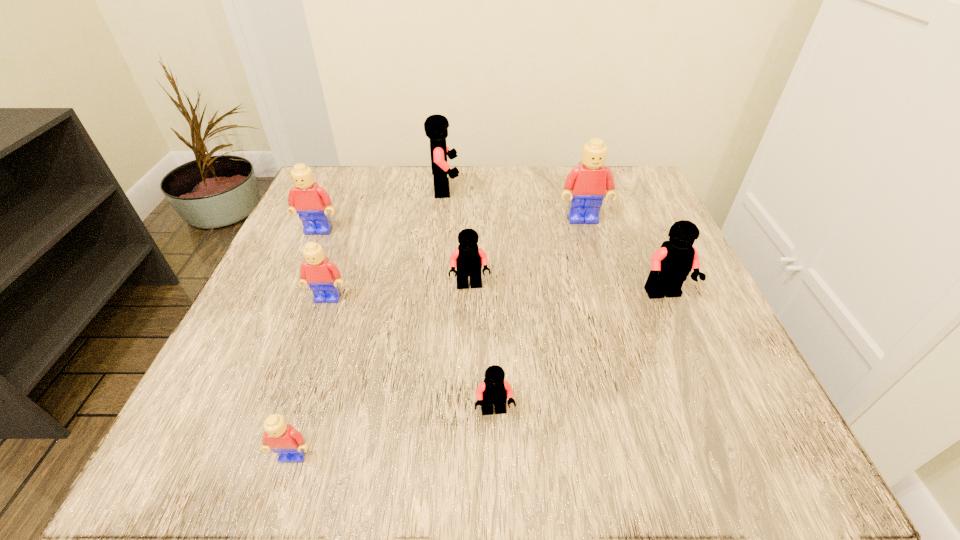
This screenshot has height=540, width=960. Identify the location of free space that is in between the third biggest yellow Lego and the farthest black Lego. (387, 244).

You are a GUI agent. You are given a task and a screenshot of the screen. Output one action in this format:
    pyautogui.click(x=<x>, y=<y>)
    Task: Click on the free space between the second biggest yellow Lego and the smallest black Lego
    The width and height of the screenshot is (960, 540).
    Given the screenshot: What is the action you would take?
    pyautogui.click(x=407, y=321)

What are the coordinates of `free space between the second smallest black Lego and the farthest Lego` in the screenshot? It's located at (458, 238).

At what (x,y) coordinates should I click in order to perform the action: click on unoccupied position between the third smallest yellow Lego and the second smallest black Lego. Please return your answer as a coordinate pair (x, y). The height and width of the screenshot is (540, 960). Looking at the image, I should click on (395, 258).

Where is `free space between the rightmost black Lego and the seventh object from left to right`? Image resolution: width=960 pixels, height=540 pixels. free space between the rightmost black Lego and the seventh object from left to right is located at coordinates (624, 257).

Identify the location of free area in between the seventh Lego from left to right and the second smallest black Lego. Image resolution: width=960 pixels, height=540 pixels. click(x=526, y=253).

Select which object is the second closest to the nearest Lego. Please provide its 2D coordinates. Your answer should be formatted as a tuple, i.e. [(x, y)], where the tuple contains the x and y coordinates of a point satisfying the conditions above.

[(322, 276)]

Point out which object is positioned as the fifth nearest to the nearest yellow Lego. Please provide its 2D coordinates. Your answer should be formatted as a tuple, i.e. [(x, y)], where the tuple contains the x and y coordinates of a point satisfying the conditions above.

[(671, 264)]

In order to click on Lego that is the seventh closest one to the second nearest yellow Lego in this screenshot , I will do `click(671, 264)`.

Locate an element on the screen. The height and width of the screenshot is (540, 960). Lego object that ranks as the fifth closest to the seventh farthest Lego is located at coordinates (587, 184).